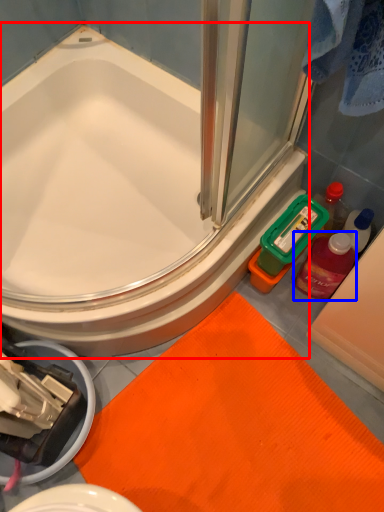
Question: Which of the following is the farthest to the observer, bathtub (highlighted by a red box) or mouthwash (highlighted by a blue box)?

Choices:
 (A) bathtub
 (B) mouthwash

Answer: (B)